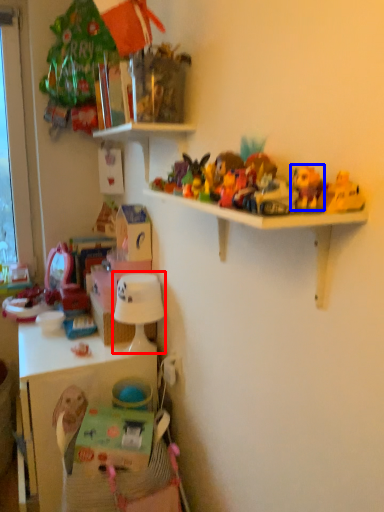
Question: Which of the following is the closest to the observer, lamp (highlighted by a red box) or toy (highlighted by a blue box)?

Choices:
 (A) lamp
 (B) toy

Answer: (B)